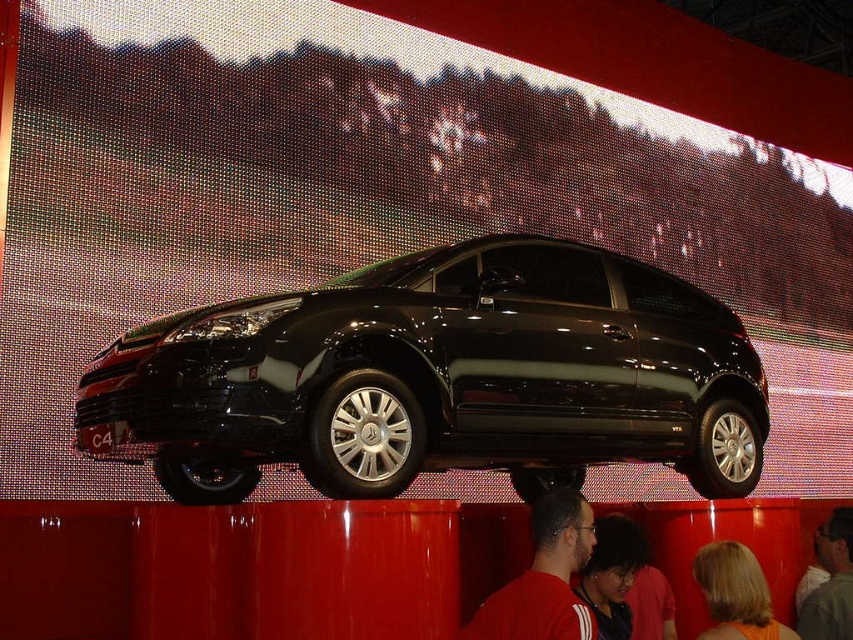
Based on the photo, you are a photographer at the auto show. You need to capture a photo of the red shirt at center and blonde hair at lower right in the same frame. Based on their positions, can you include both in a single shot without moving the camera?

The red shirt at center is located above blonde hair at lower right, so yes, you can include both in a single shot by ensuring the camera frame captures the vertical space between them.

You are at the auto show and want to take a photo of the black car. You notice two points marked on the car, one at point (708, 577) and another at point (808, 600). Which point will appear larger in your photo?

Point (708, 577) will appear larger in the photo because it is closer to the camera than point (808, 600).